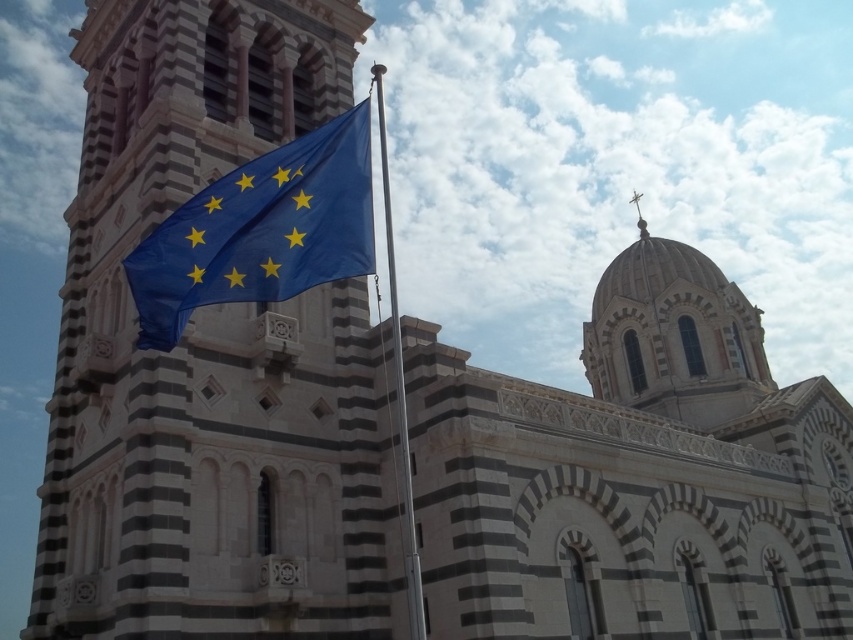
You are standing in front of the cathedral with the striped facade. There is a flagpole with the EU flag in the foreground. Can you tell me what object is located exactly at the coordinate point [260,230]?

The blue fabric flag at center is located at point [260,230].